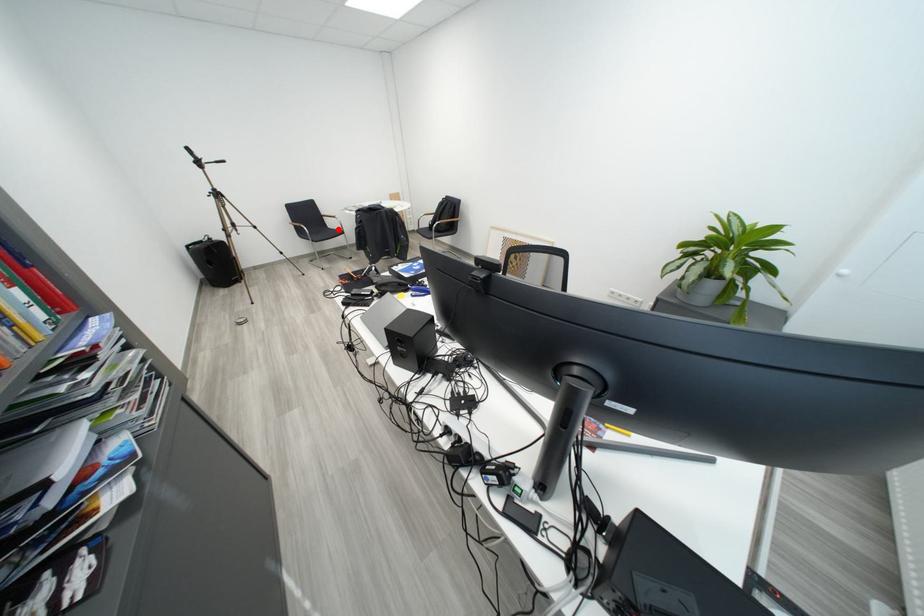
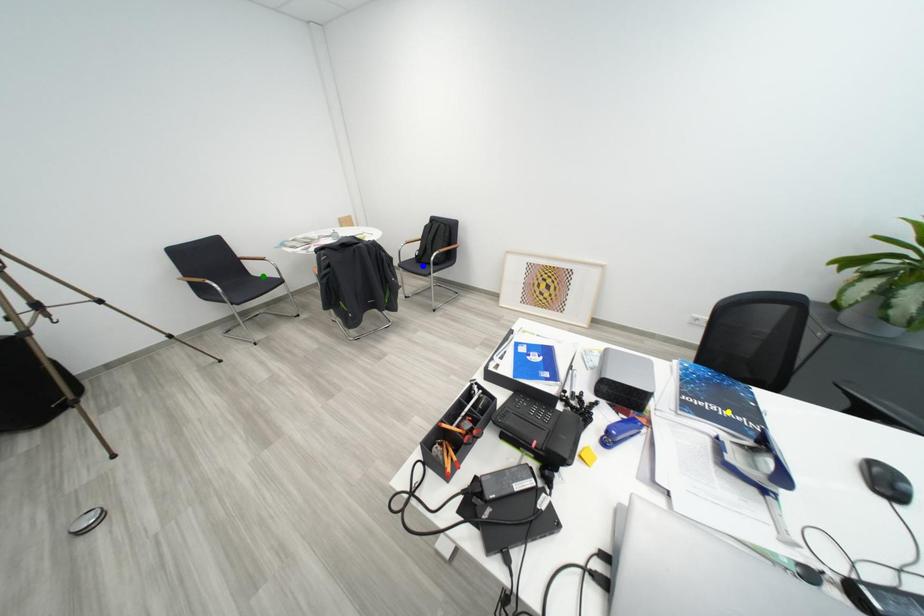
Question: I am providing you with two images of the same scene from different viewpoints. A red point is marked on the first image. You are given multiple points on the second image. Which mark in image 2 goes with the point in image 1?

Choices:
 (A) yellow point
 (B) green point
 (C) blue point

Answer: (B)